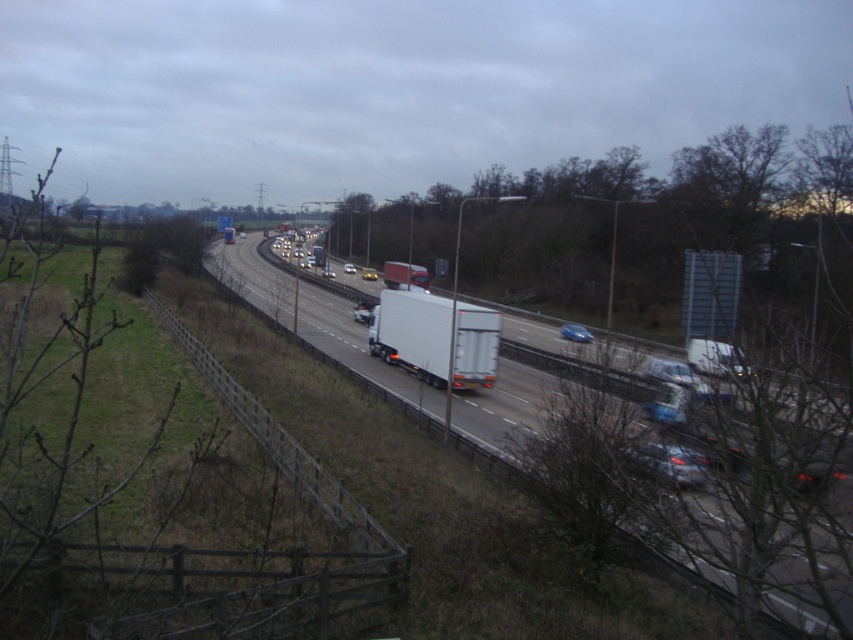
Question: Estimate the real-world distances between objects in this image. Which object is farther from the blue metallic sedan at center?

Choices:
 (A) white glossy truck at center
 (B) matte white truck at center
 (C) white matte trailer truck at center

Answer: (B)

Question: Among these points, which one is nearest to the camera?

Choices:
 (A) 570,337
 (B) 375,275

Answer: (A)

Question: Which object is farther from the camera taking this photo?

Choices:
 (A) blue metallic sedan at center
 (B) white glossy sedan at center
 (C) white matte truck at center
 (D) matte white truck at center

Answer: (B)

Question: Can you confirm if matte white truck at center is positioned to the right of white glossy sedan at center?

Choices:
 (A) yes
 (B) no

Answer: (A)

Question: Can you confirm if white glossy truck at center is positioned below white glossy sedan at center?

Choices:
 (A) yes
 (B) no

Answer: (A)

Question: Does blue metallic sedan at center appear on the left side of matte white truck at center?

Choices:
 (A) no
 (B) yes

Answer: (A)